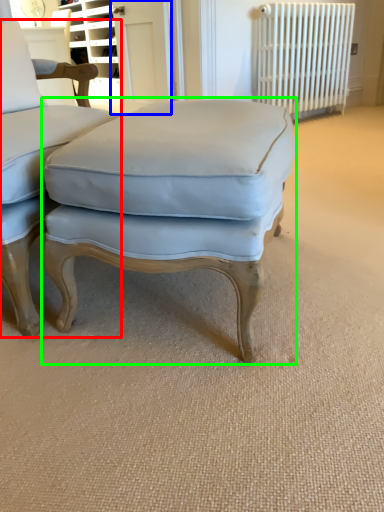
Question: Considering the real-world distances, which object is closest to chair (highlighted by a red box)? screen door (highlighted by a blue box) or stool (highlighted by a green box).

Choices:
 (A) screen door
 (B) stool

Answer: (B)